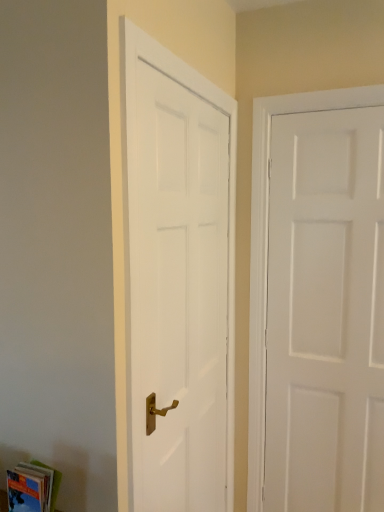
Question: In the image, is white matte door at right, the 2th door viewed from the left, on the left side or the right side of hardcover book at lower left?

Choices:
 (A) right
 (B) left

Answer: (A)

Question: From a real-world perspective, is white matte door at right, the 1th door in the right-to-left sequence, above or below hardcover book at lower left?

Choices:
 (A) above
 (B) below

Answer: (A)

Question: Which of these objects is positioned farthest from the white matte door at right, the 2th door viewed from the left?

Choices:
 (A) white smooth door at left, which is counted as the second door, starting from the right
 (B) hardcover book at lower left

Answer: (B)

Question: Which object is positioned farthest from the white matte door at right, the 2th door viewed from the left?

Choices:
 (A) white smooth door at left, placed as the 1th door when sorted from left to right
 (B) hardcover book at lower left

Answer: (B)